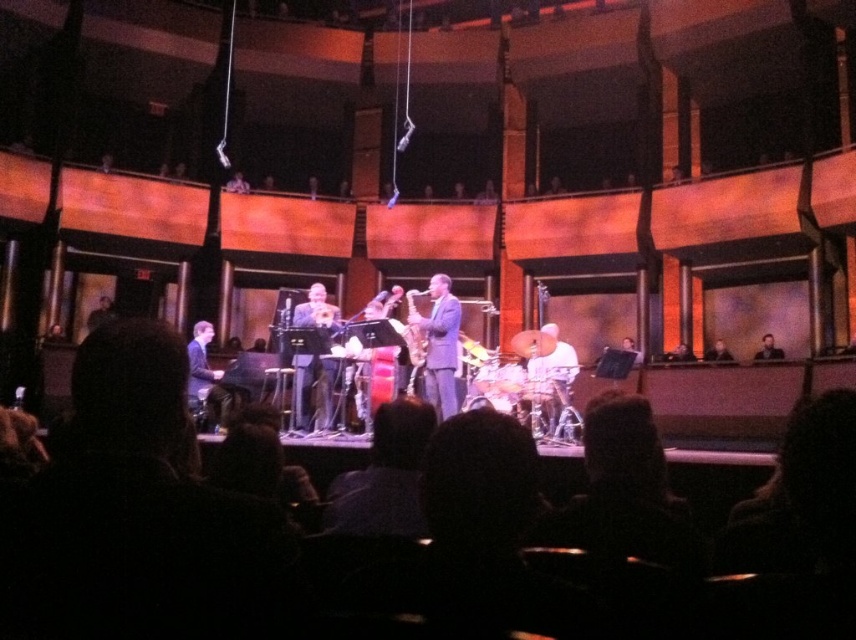
You are an audience member sitting in the front row of the theater. You want to quickly move to the light brown wooden chair at right without going through the stage. Can you walk directly past the matte black piano at lower left to reach it?

The matte black piano at lower left is closer to the viewer than the light brown wooden chair at right, so you would need to go around it rather than walking directly past it to reach the chair.

You are an audience member sitting in the front row. You want to see both the matte black piano at lower left and the shiny gold saxophone at center. Which instrument will appear higher in your field of view?

The shiny gold saxophone at center appears higher in your field of view because the matte black piano at lower left is located below it.

You are a photographer in the front row of the audience. You want to take a photo of both the shiny silver saxophone at center and the matte gold saxophone at center. Which saxophone should you pan your camera to the right to capture first?

You should pan your camera to the right to capture the shiny silver saxophone at center first because it is positioned to the right of the matte gold saxophone at center.